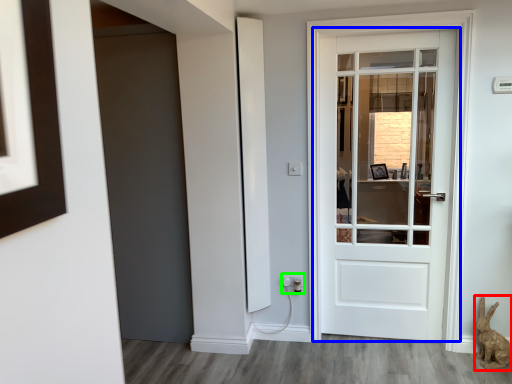
Question: Which object is the farthest from animal (highlighted by a red box)? Choose among these: door (highlighted by a blue box) or electric outlet (highlighted by a green box).

Choices:
 (A) door
 (B) electric outlet

Answer: (A)